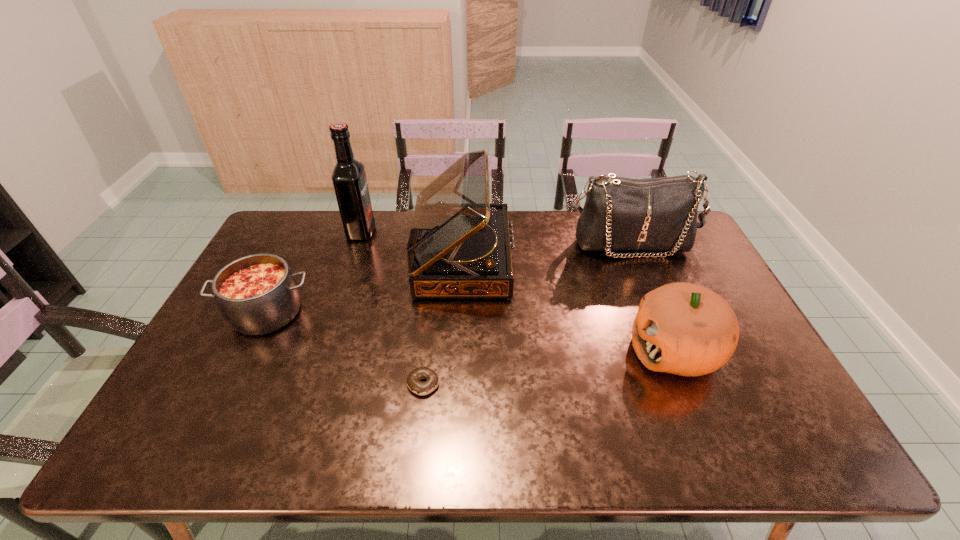
You are a GUI agent. You are given a task and a screenshot of the screen. Output one action in this format:
    pyautogui.click(x=<x>, y=<y>)
    Task: Click on the handbag at the right edge
    
    Given the screenshot: What is the action you would take?
    pyautogui.click(x=620, y=214)

This screenshot has width=960, height=540. Find the location of `pumpkin at the right edge`. pumpkin at the right edge is located at coordinates 686,329.

The width and height of the screenshot is (960, 540). In order to click on object present at the far right corner in this screenshot , I will do `click(620, 214)`.

This screenshot has width=960, height=540. Find the location of `vacant space at the near edge of the desktop`. vacant space at the near edge of the desktop is located at coordinates (418, 425).

The image size is (960, 540). Find the location of `vacant space at the left edge of the desktop`. vacant space at the left edge of the desktop is located at coordinates (162, 417).

The image size is (960, 540). In the image, there is a desktop. Find the location of `blank space at the right edge`. blank space at the right edge is located at coordinates (666, 266).

In the image, there is a desktop. At what (x,y) coordinates should I click in order to perform the action: click on vacant space at the far left corner. Please return your answer as a coordinate pair (x, y). Looking at the image, I should click on (282, 237).

This screenshot has width=960, height=540. I want to click on vacant space in between the record player and the handbag, so click(546, 251).

At what (x,y) coordinates should I click in order to perform the action: click on free space between the doughnut and the handbag. Please return your answer as a coordinate pair (x, y). Looking at the image, I should click on (526, 314).

This screenshot has height=540, width=960. Identify the location of vacant area that lies between the record player and the handbag. (546, 251).